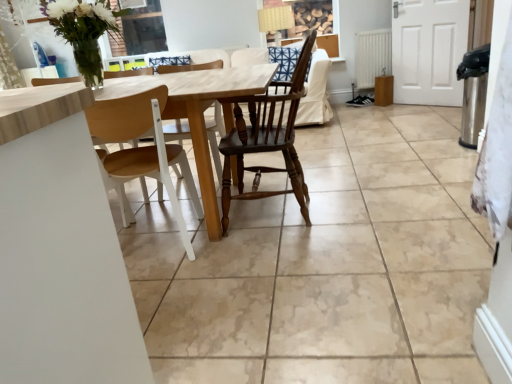
Question: Considering the positions of white matte radiator at right and satin white towel at right in the image, is white matte radiator at right wider or thinner than satin white towel at right?

Choices:
 (A) wide
 (B) thin

Answer: (A)

Question: In terms of size, does white matte radiator at right appear bigger or smaller than satin white towel at right?

Choices:
 (A) big
 (B) small

Answer: (A)

Question: Which object is the farthest from the satin white towel at right?

Choices:
 (A) wooden at left, placed as the first chair when sorted from left to right
 (B) light wood table at center
 (C) white matte radiator at right
 (D) dark wood chair at center, placed as the second chair when sorted from left to right

Answer: (C)

Question: Which object is positioned closest to the dark wood chair at center, positioned as the 1th chair in right-to-left order?

Choices:
 (A) white matte radiator at right
 (B) light wood table at center
 (C) wooden at left, placed as the first chair when sorted from left to right
 (D) satin white towel at right

Answer: (B)